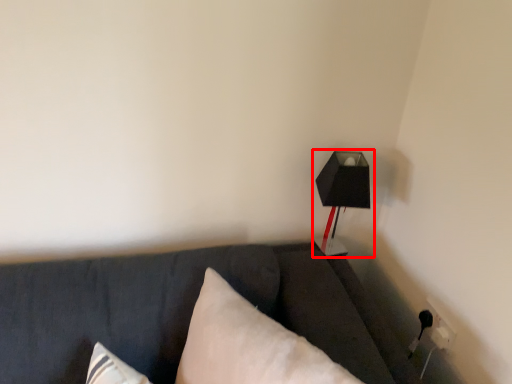
Question: From the image's perspective, what is the correct spatial positioning of lamp (annotated by the red box) in reference to pillow?

Choices:
 (A) below
 (B) above

Answer: (B)